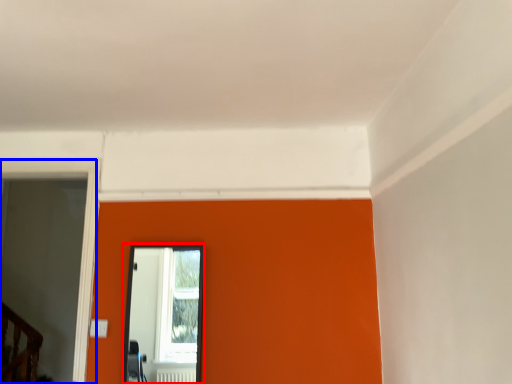
Question: Which object appears closest to the camera in this image, mirror (highlighted by a red box) or glass door (highlighted by a blue box)?

Choices:
 (A) mirror
 (B) glass door

Answer: (B)